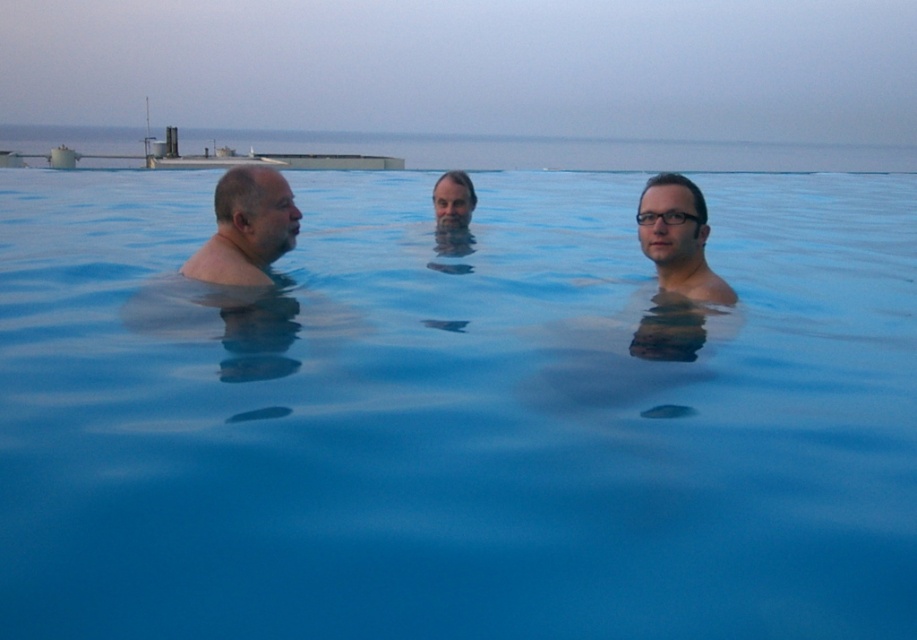
Is smooth skin head at left behind clear plastic glasses at center?

Yes, smooth skin head at left is behind clear plastic glasses at center.

Does smooth skin head at left appear under clear plastic glasses at center?

Yes.

Between point (246, 209) and point (659, 216), which one is positioned in front?

Point (659, 216)

You are a GUI agent. You are given a task and a screenshot of the screen. Output one action in this format:
    pyautogui.click(x=<x>, y=<y>)
    Task: Click on the smooth skin head at left
    
    Given the screenshot: What is the action you would take?
    pyautogui.click(x=246, y=228)

Between point (551, 445) and point (686, 216), which one is positioned behind?

Point (686, 216)

Does blue smooth water at center have a lesser width compared to matte black hair at center?

Incorrect, blue smooth water at center's width is not less than matte black hair at center's.

Does point (451, 332) lie behind point (677, 236)?

Yes, point (451, 332) is behind point (677, 236).

The image size is (917, 640). I want to click on blue smooth water at center, so click(x=456, y=416).

Consider the image. Is blue smooth water at center wider than clear plastic glasses at center?

Indeed, blue smooth water at center has a greater width compared to clear plastic glasses at center.

Does blue smooth water at center appear on the left side of clear plastic glasses at center?

Indeed, blue smooth water at center is positioned on the left side of clear plastic glasses at center.

Is point (499, 493) positioned in front of point (653, 216)?

Yes, it is in front of point (653, 216).

Locate an element on the screen. The image size is (917, 640). blue smooth water at center is located at coordinates (456, 416).